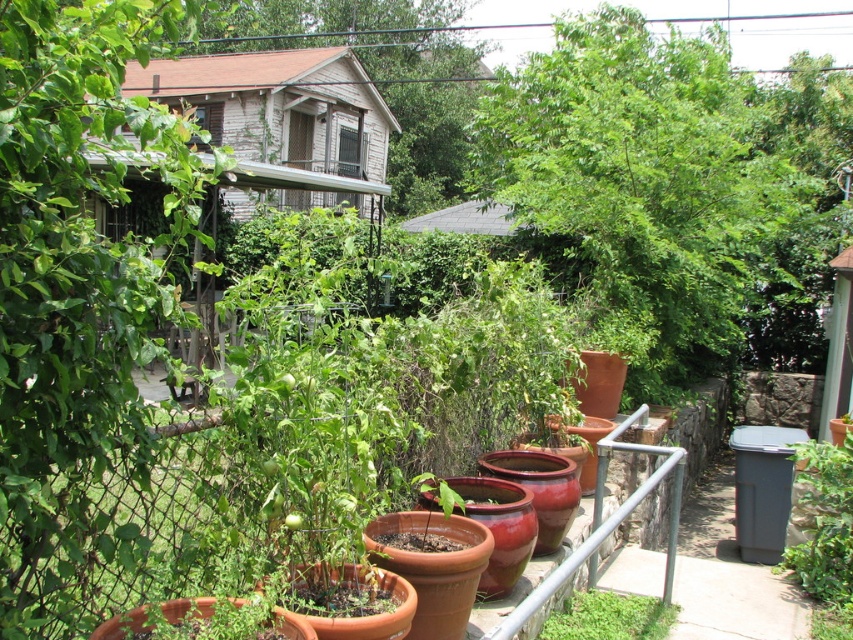
Question: Which point is farther to the camera?

Choices:
 (A) (558, 634)
 (B) (850, 444)

Answer: (B)

Question: Does green matte plant at lower right have a greater width compared to green matte plant at lower center?

Choices:
 (A) no
 (B) yes

Answer: (A)

Question: Is green matte plant at lower right positioned at the back of green matte plant at lower center?

Choices:
 (A) yes
 (B) no

Answer: (A)

Question: Which object is closer to the camera taking this photo?

Choices:
 (A) green matte plant at lower center
 (B) green matte plant at lower right

Answer: (A)

Question: Is green matte plant at lower right positioned behind green matte plant at lower center?

Choices:
 (A) no
 (B) yes

Answer: (B)

Question: Which point is closer to the camera taking this photo?

Choices:
 (A) (606, 589)
 (B) (851, 474)

Answer: (A)